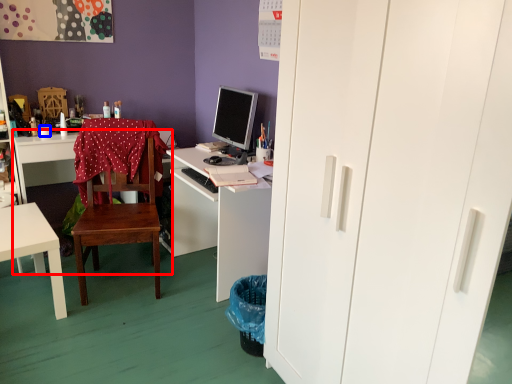
Question: Among these objects, which one is nearest to the camera, desk (highlighted by a red box) or coffee cup (highlighted by a blue box)?

Choices:
 (A) desk
 (B) coffee cup

Answer: (A)